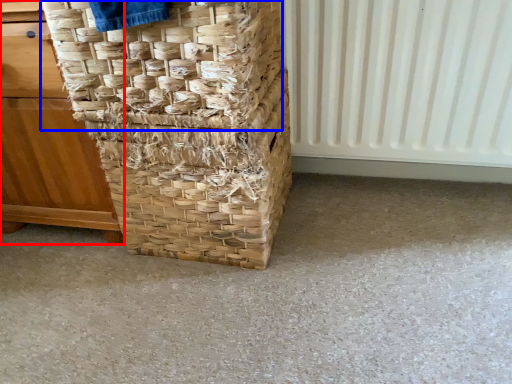
Question: Which point is closer to the camera, furniture (highlighted by a red box) or basket (highlighted by a blue box)?

Choices:
 (A) furniture
 (B) basket

Answer: (B)